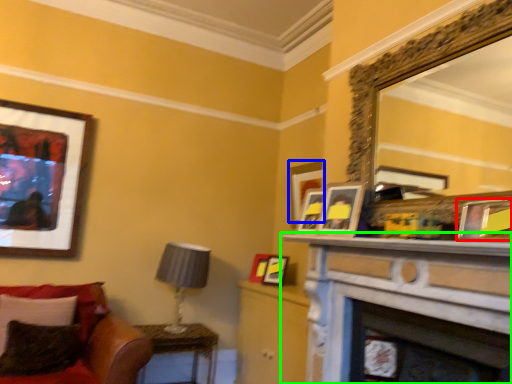
Question: Which is farther away from picture frame (highlighted by a red box)? picture frame (highlighted by a blue box) or shelf (highlighted by a green box)?

Choices:
 (A) picture frame
 (B) shelf

Answer: (A)